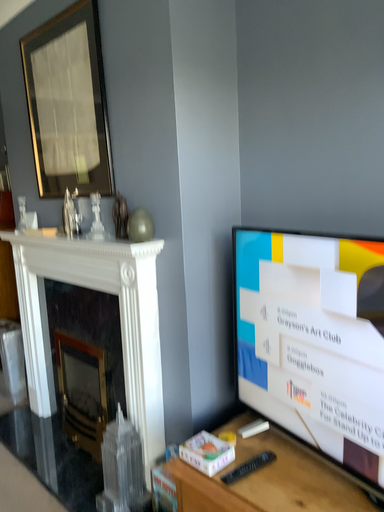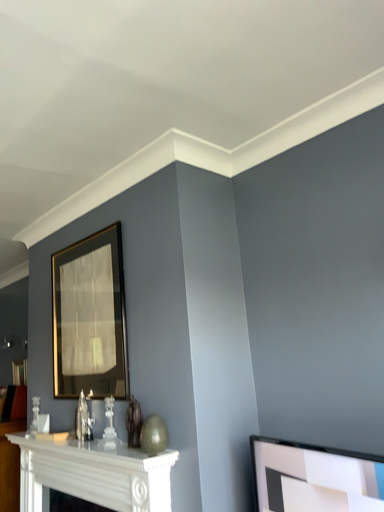
Question: How did the camera likely rotate when shooting the video?

Choices:
 (A) rotated upward
 (B) rotated downward

Answer: (A)